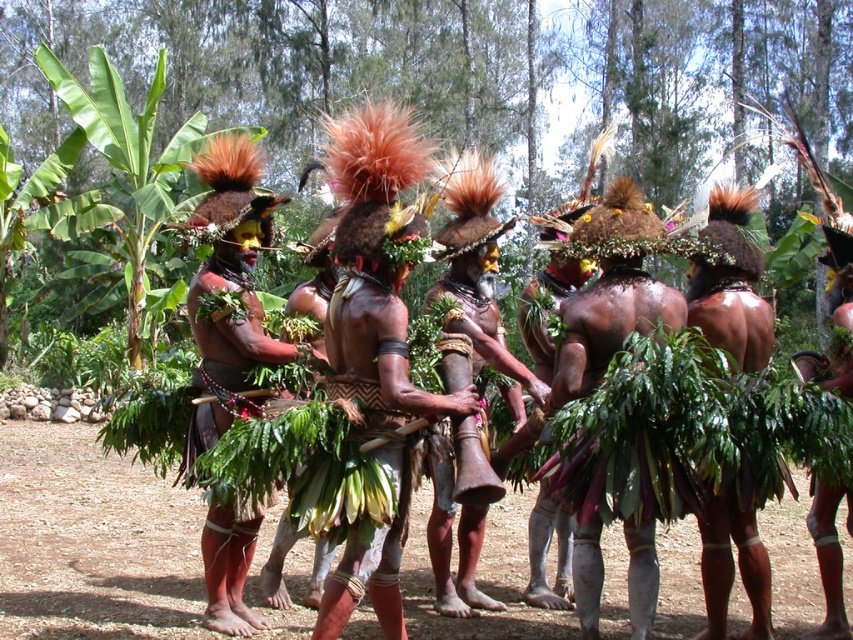
Does brown textured leaf skirt at center have a greater height compared to green leafy skirt at center?

Yes.

Does brown textured leaf skirt at center appear on the right side of green leafy skirt at center?

In fact, brown textured leaf skirt at center is to the left of green leafy skirt at center.

Does point (375, 269) come behind point (587, 540)?

That is False.

This screenshot has width=853, height=640. Find the location of `brown textured leaf skirt at center`. brown textured leaf skirt at center is located at coordinates (381, 312).